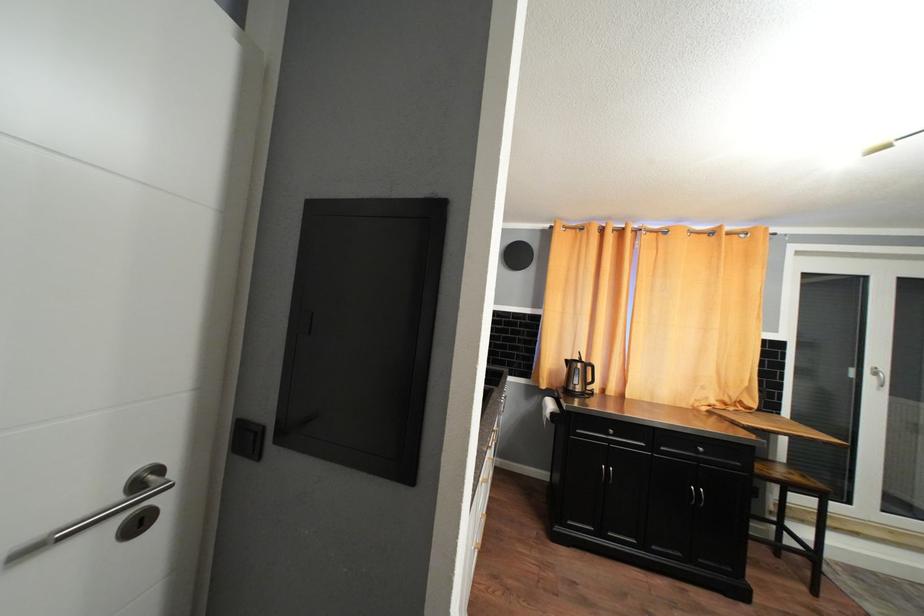
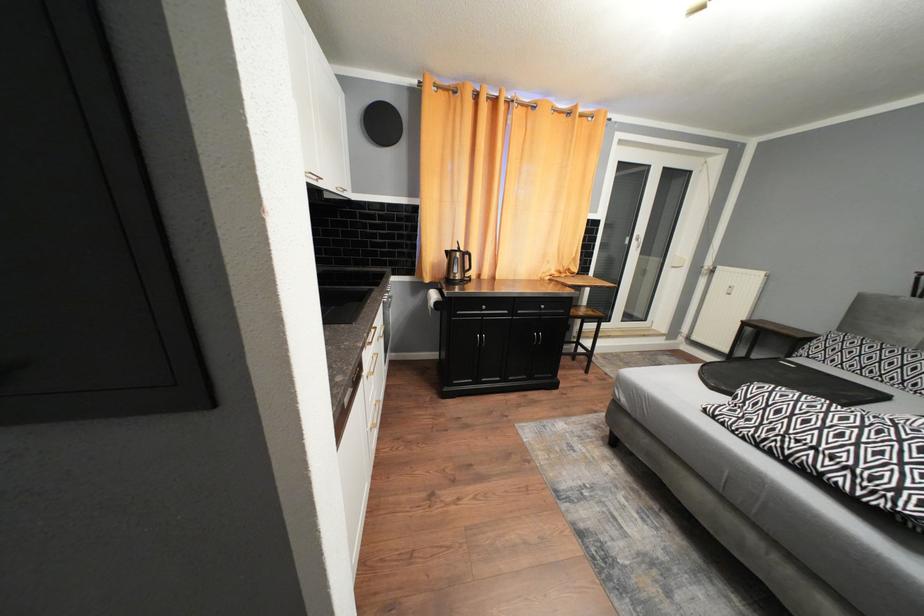
How did the camera likely rotate?

The rotation direction of the camera is right-down.